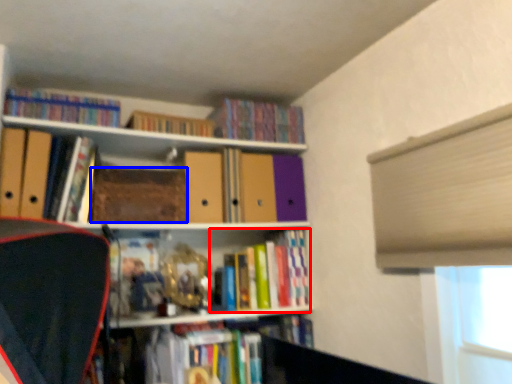
Question: Which object appears closest to the camera in this image, book (highlighted by a red box) or paperback book (highlighted by a blue box)?

Choices:
 (A) book
 (B) paperback book

Answer: (B)